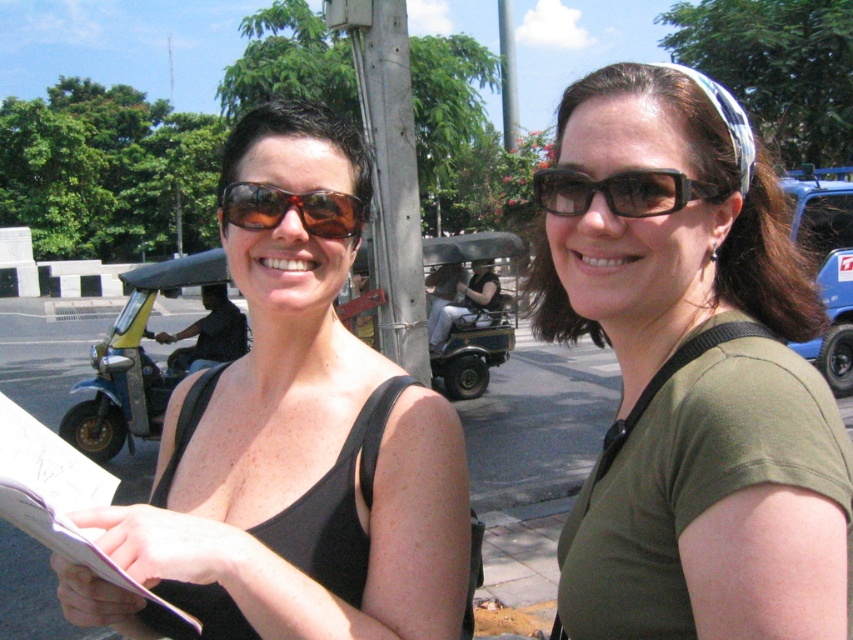
Can you confirm if green matte shirt at center is positioned to the left of matte black tank top at left?

Incorrect, green matte shirt at center is not on the left side of matte black tank top at left.

Does green matte shirt at center have a lesser height compared to matte black tank top at left?

No, green matte shirt at center is not shorter than matte black tank top at left.

Between point (595, 289) and point (221, 536), which one is positioned behind?

The point (595, 289) is more distant.

Where is `green matte shirt at center`? green matte shirt at center is located at coordinates (689, 374).

Does green matte shirt at center appear on the right side of black plastic sunglasses at upper center?

Yes, green matte shirt at center is to the right of black plastic sunglasses at upper center.

Who is lower down, green matte shirt at center or black plastic sunglasses at upper center?

green matte shirt at center is lower down.

The height and width of the screenshot is (640, 853). What do you see at coordinates (689, 374) in the screenshot?
I see `green matte shirt at center` at bounding box center [689, 374].

Image resolution: width=853 pixels, height=640 pixels. Identify the location of green matte shirt at center. (689, 374).

Who is more forward, (705,192) or (310,216)?

Positioned in front is point (705,192).

Which is in front, point (546, 172) or point (306, 216)?

Point (546, 172) is more forward.

Where is `black plastic sunglasses at upper center`? This screenshot has height=640, width=853. black plastic sunglasses at upper center is located at coordinates (621, 192).